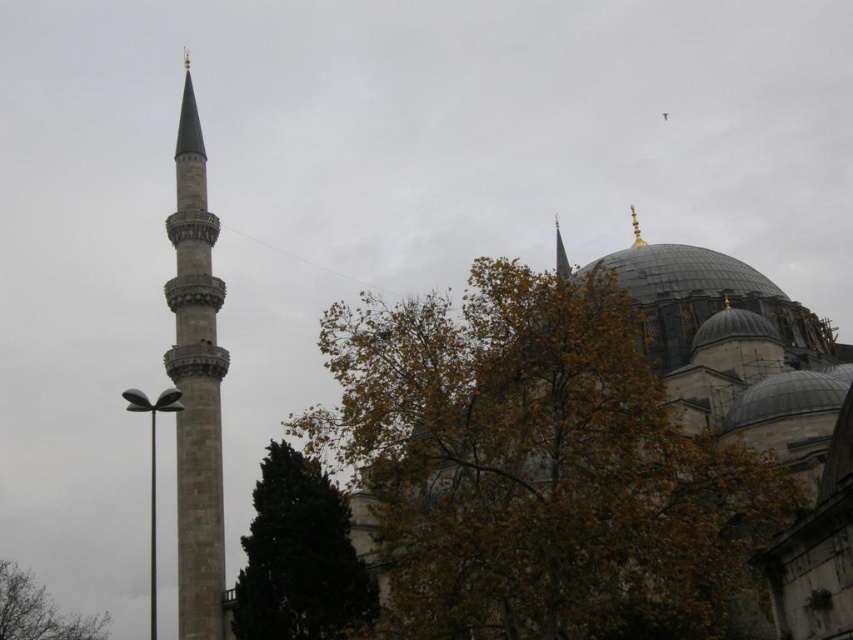
Question: Can you confirm if dark green coniferous tree at lower center is smaller than gold polished spire at upper center?

Choices:
 (A) yes
 (B) no

Answer: (B)

Question: Can you confirm if gold polished spire at upper center is wider than gold metallic spire at upper center?

Choices:
 (A) yes
 (B) no

Answer: (A)

Question: Among these points, which one is farthest from the camera?

Choices:
 (A) (556, 266)
 (B) (635, 214)
 (C) (178, 474)
 (D) (374, 609)

Answer: (A)

Question: Based on their relative distances, which object is nearer to the gray stone minaret at left?

Choices:
 (A) brown leafy tree at center
 (B) gold polished spire at upper center
 (C) dark green coniferous tree at lower center
 (D) gold metallic spire at upper center

Answer: (C)

Question: Is dark green coniferous tree at lower center positioned at the back of gold polished spire at upper center?

Choices:
 (A) no
 (B) yes

Answer: (A)

Question: Which point is closer to the camera taking this photo?

Choices:
 (A) (210, 545)
 (B) (566, 257)
 (C) (94, 621)

Answer: (A)